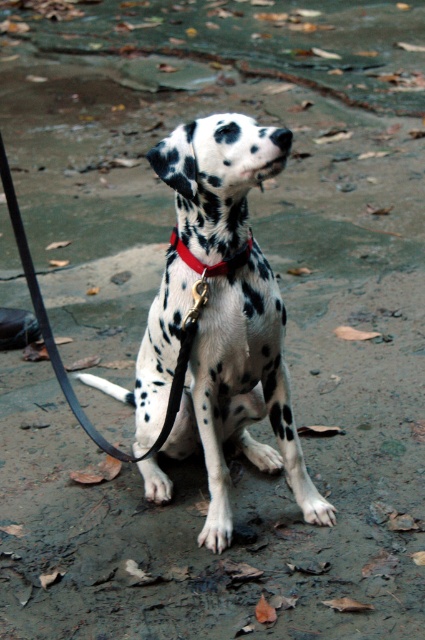
Is black leather leash at center positioned at the back of red leather collar at center?

No.

Can you confirm if black leather leash at center is shorter than red leather collar at center?

In fact, black leather leash at center may be taller than red leather collar at center.

The height and width of the screenshot is (640, 425). What do you see at coordinates (57, 349) in the screenshot?
I see `black leather leash at center` at bounding box center [57, 349].

The image size is (425, 640). What are the coordinates of `black leather leash at center` in the screenshot? It's located at (57, 349).

Who is positioned more to the right, white-spotted fur dog at center or black leather leash at center?

white-spotted fur dog at center

Is white-spotted fur dog at center thinner than black leather leash at center?

Indeed, white-spotted fur dog at center has a lesser width compared to black leather leash at center.

Find the location of a particular element. white-spotted fur dog at center is located at coordinates (241, 394).

Between white-spotted fur dog at center and red leather collar at center, which one has more height?

With more height is white-spotted fur dog at center.

Does white-spotted fur dog at center have a larger size compared to red leather collar at center?

Indeed, white-spotted fur dog at center has a larger size compared to red leather collar at center.

Which is in front, point (204, 317) or point (232, 268)?

Point (204, 317) is more forward.

Locate an element on the screen. Image resolution: width=425 pixels, height=640 pixels. white-spotted fur dog at center is located at coordinates (241, 394).